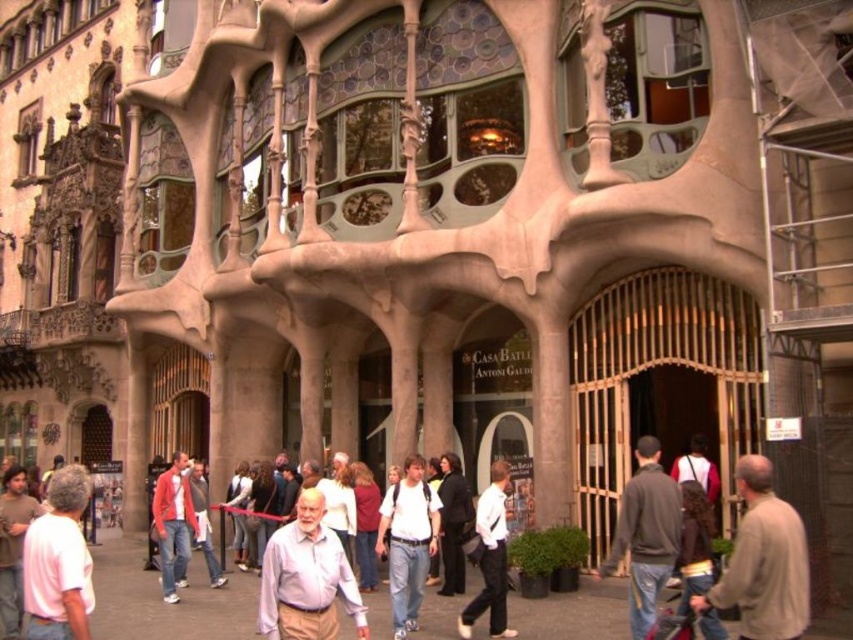
Is brown leather jacket at lower right to the right of white cotton shirt at center from the viewer's perspective?

Yes, brown leather jacket at lower right is to the right of white cotton shirt at center.

You are a GUI agent. You are given a task and a screenshot of the screen. Output one action in this format:
    pyautogui.click(x=<x>, y=<y>)
    Task: Click on the brown leather jacket at lower right
    The image size is (853, 640).
    Given the screenshot: What is the action you would take?
    tap(763, 561)

Who is taller, pink cotton shirt at lower left or light blue shirt at center?

pink cotton shirt at lower left

I want to click on pink cotton shirt at lower left, so click(57, 563).

What do you see at coordinates (57, 563) in the screenshot? I see `pink cotton shirt at lower left` at bounding box center [57, 563].

You are a GUI agent. You are given a task and a screenshot of the screen. Output one action in this format:
    pyautogui.click(x=<x>, y=<y>)
    Task: Click on the pink cotton shirt at lower left
    
    Given the screenshot: What is the action you would take?
    pyautogui.click(x=57, y=563)

Does point (282, 580) come behind point (405, 536)?

No.

Between light purple shirt at center and white cotton shirt at center, which one has more height?

white cotton shirt at center

What are the coordinates of `light purple shirt at center` in the screenshot? It's located at (306, 579).